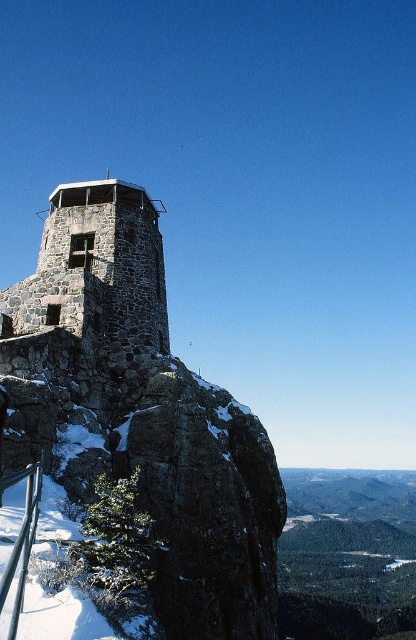
Question: Is stone tower at center to the right of rustic stone tower at center from the viewer's perspective?

Choices:
 (A) yes
 (B) no

Answer: (A)

Question: Which point is farther to the camera?

Choices:
 (A) metal/rustic rail at lower left
 (B) stone tower at center

Answer: (B)

Question: Estimate the real-world distances between objects in this image. Which object is farther from the stone tower at center?

Choices:
 (A) rustic stone tower at center
 (B) metal/rustic rail at lower left

Answer: (B)

Question: Is rustic stone tower at center positioned before metal/rustic rail at lower left?

Choices:
 (A) yes
 (B) no

Answer: (B)

Question: Can you confirm if stone tower at center is smaller than rustic stone tower at center?

Choices:
 (A) yes
 (B) no

Answer: (B)

Question: Which point is farther from the camera taking this photo?

Choices:
 (A) (29, 547)
 (B) (168, 547)
 (C) (113, 337)

Answer: (C)